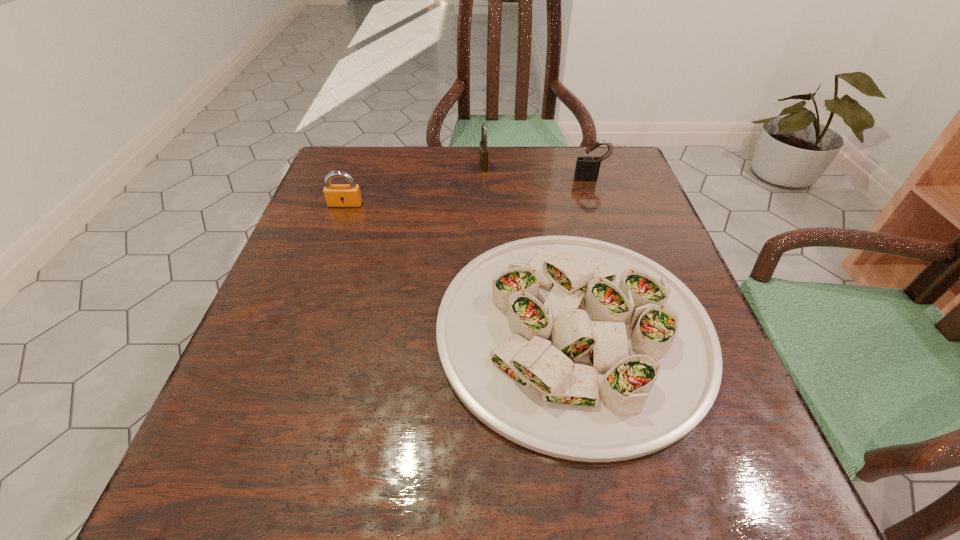
In order to click on vacant point located to unlock the leftmost object from the front in this screenshot , I will do (x=336, y=230).

Locate an element on the screen. Image resolution: width=960 pixels, height=540 pixels. vacant space located on the left of the platter is located at coordinates (372, 330).

Locate an element on the screen. object located at the near edge is located at coordinates pos(576,348).

Where is `object located in the left edge section of the desktop`? object located in the left edge section of the desktop is located at coordinates (337, 195).

Identify the location of padlock present at the right edge. The height and width of the screenshot is (540, 960). (587, 168).

Identify the location of platter located in the right edge section of the desktop. The width and height of the screenshot is (960, 540). (576, 348).

This screenshot has width=960, height=540. Find the location of `object present at the far right corner`. object present at the far right corner is located at coordinates (587, 168).

The image size is (960, 540). Find the location of `object that is at the near right corner`. object that is at the near right corner is located at coordinates (576, 348).

Image resolution: width=960 pixels, height=540 pixels. I want to click on free space at the far edge of the desktop, so click(x=433, y=149).

This screenshot has height=540, width=960. In order to click on free space at the left edge of the desktop in this screenshot , I will do `click(340, 302)`.